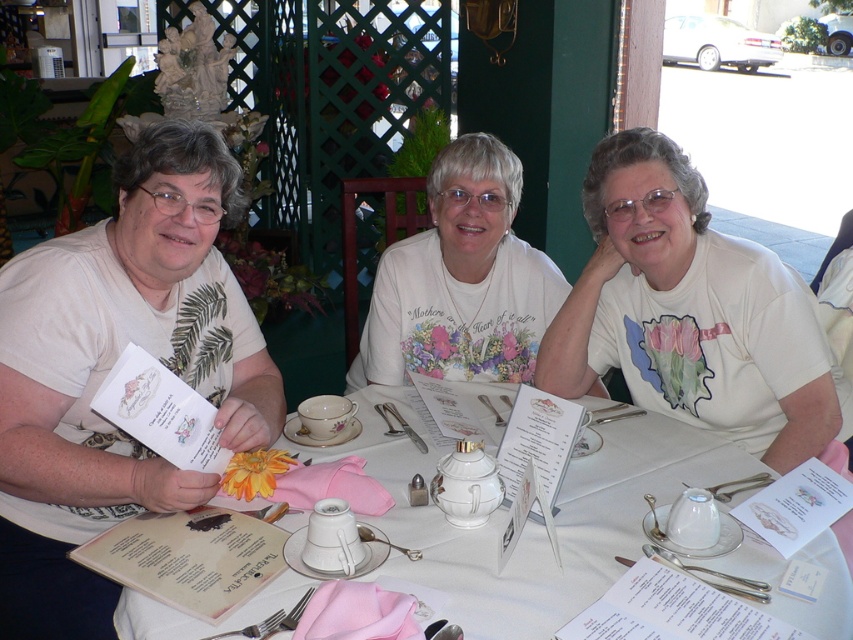
Question: Can you confirm if white porcelain teapot at center is bigger than white glossy teapot at center?

Choices:
 (A) no
 (B) yes

Answer: (B)

Question: Is white printed menu at left above white floral shirt at center?

Choices:
 (A) no
 (B) yes

Answer: (A)

Question: Which object is positioned farthest from the white matte shirt at center?

Choices:
 (A) white floral shirt at center
 (B) white printed menu at left

Answer: (B)

Question: Does white floral shirt at center come behind white glossy teapot at center?

Choices:
 (A) yes
 (B) no

Answer: (A)

Question: Which of the following is the closest to the observer?

Choices:
 (A) (548, 572)
 (B) (444, 364)

Answer: (A)

Question: Which of the following is the closest to the observer?

Choices:
 (A) (546, 540)
 (B) (514, 243)

Answer: (A)